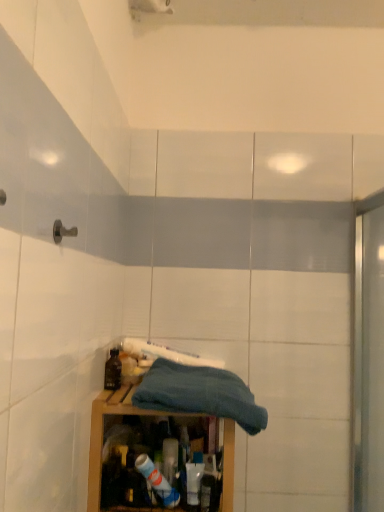
Question: Can you confirm if wooden cabinet at lower center is wider than matte black bottle at lower left?

Choices:
 (A) no
 (B) yes

Answer: (B)

Question: Does wooden cabinet at lower center turn towards matte black bottle at lower left?

Choices:
 (A) no
 (B) yes

Answer: (A)

Question: From a real-world perspective, is wooden cabinet at lower center beneath matte black bottle at lower left?

Choices:
 (A) yes
 (B) no

Answer: (A)

Question: Considering the relative positions of wooden cabinet at lower center and matte black bottle at lower left in the image provided, is wooden cabinet at lower center to the right of matte black bottle at lower left from the viewer's perspective?

Choices:
 (A) no
 (B) yes

Answer: (B)

Question: Is the position of wooden cabinet at lower center more distant than that of matte black bottle at lower left?

Choices:
 (A) no
 (B) yes

Answer: (A)

Question: From a real-world perspective, is matte black bottle at lower left positioned above or below wooden cabinet at lower center?

Choices:
 (A) below
 (B) above

Answer: (B)

Question: Looking at the image, does matte black bottle at lower left seem bigger or smaller compared to wooden cabinet at lower center?

Choices:
 (A) big
 (B) small

Answer: (B)

Question: Is matte black bottle at lower left in front of or behind wooden cabinet at lower center in the image?

Choices:
 (A) behind
 (B) front

Answer: (A)

Question: Would you say matte black bottle at lower left is to the left or to the right of wooden cabinet at lower center in the picture?

Choices:
 (A) left
 (B) right

Answer: (A)

Question: In terms of width, does matte black bottle at lower left look wider or thinner when compared to blue cotton towel at center?

Choices:
 (A) wide
 (B) thin

Answer: (B)

Question: From a real-world perspective, is matte black bottle at lower left above or below blue cotton towel at center?

Choices:
 (A) below
 (B) above

Answer: (B)

Question: Considering the positions of matte black bottle at lower left and blue cotton towel at center in the image, is matte black bottle at lower left taller or shorter than blue cotton towel at center?

Choices:
 (A) tall
 (B) short

Answer: (B)

Question: Would you say matte black bottle at lower left is inside or outside blue cotton towel at center?

Choices:
 (A) outside
 (B) inside

Answer: (A)

Question: Is blue cotton towel at center spatially inside matte black bottle at lower left, or outside of it?

Choices:
 (A) inside
 (B) outside

Answer: (B)

Question: In terms of size, does blue cotton towel at center appear bigger or smaller than matte black bottle at lower left?

Choices:
 (A) big
 (B) small

Answer: (A)